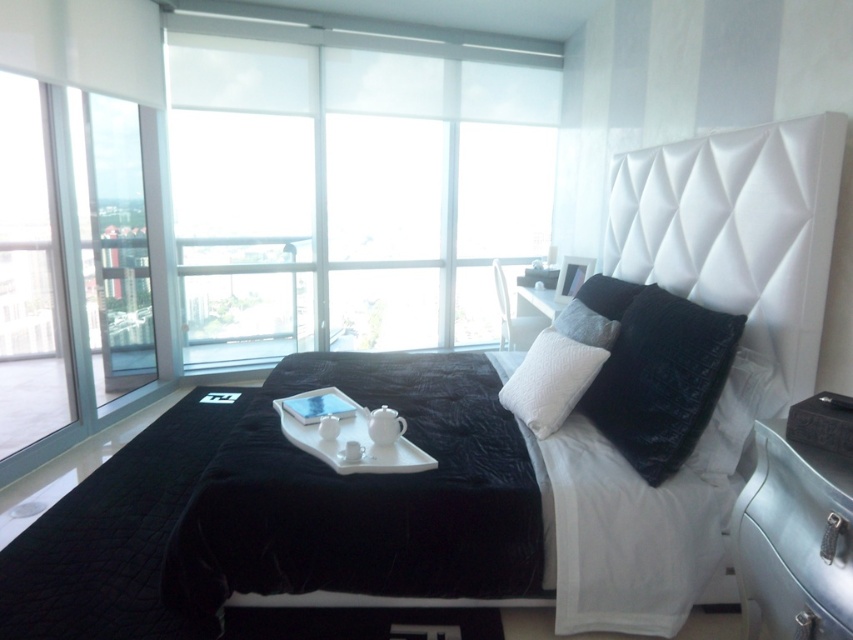
Can you confirm if black velvet pillow at center is thinner than transparent glass door at left?

No.

Which is in front, point (693, 404) or point (131, 369)?

Positioned in front is point (693, 404).

The height and width of the screenshot is (640, 853). What are the coordinates of `black velvet pillow at center` in the screenshot? It's located at (656, 371).

Can you confirm if white textured headboard at upper right is wider than white textured pillow at center?

In fact, white textured headboard at upper right might be narrower than white textured pillow at center.

In the scene shown: Is the position of white textured headboard at upper right more distant than that of white textured pillow at center?

No.

Where is `white textured headboard at upper right`? The image size is (853, 640). white textured headboard at upper right is located at coordinates (737, 228).

At what (x,y) coordinates should I click in order to perform the action: click on white textured headboard at upper right. Please return your answer as a coordinate pair (x, y). Looking at the image, I should click on (737, 228).

Does white textured headboard at upper right appear over transparent glass window at left?

Yes, white textured headboard at upper right is above transparent glass window at left.

Locate an element on the screen. The image size is (853, 640). white textured headboard at upper right is located at coordinates (737, 228).